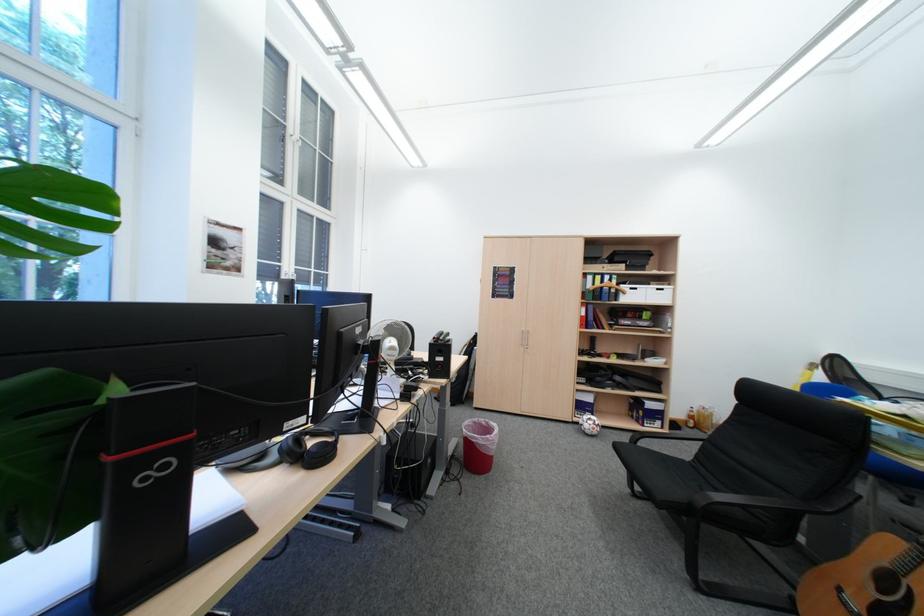
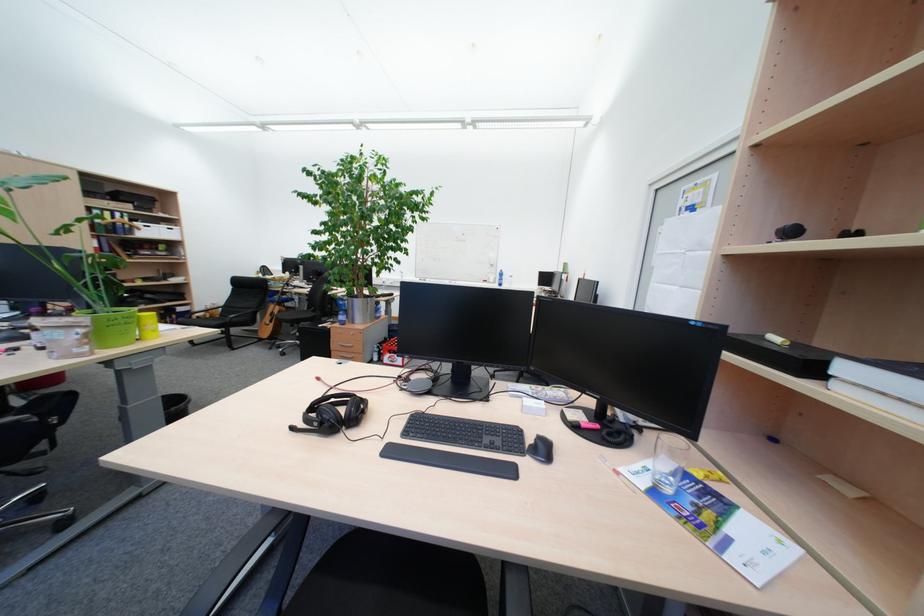
Find the pixel in the second image that matches the point at 610,285 in the first image.

(120, 220)